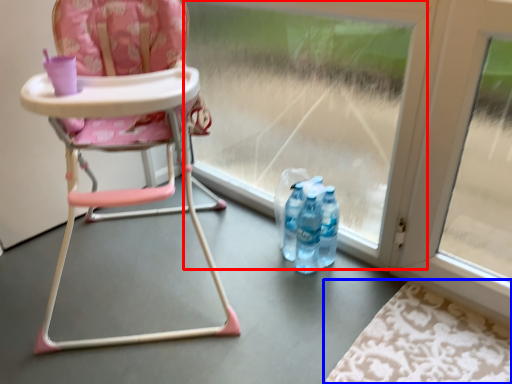
Question: Which point is closer to the camera, glass door (highlighted by a red box) or mat (highlighted by a blue box)?

Choices:
 (A) glass door
 (B) mat

Answer: (B)